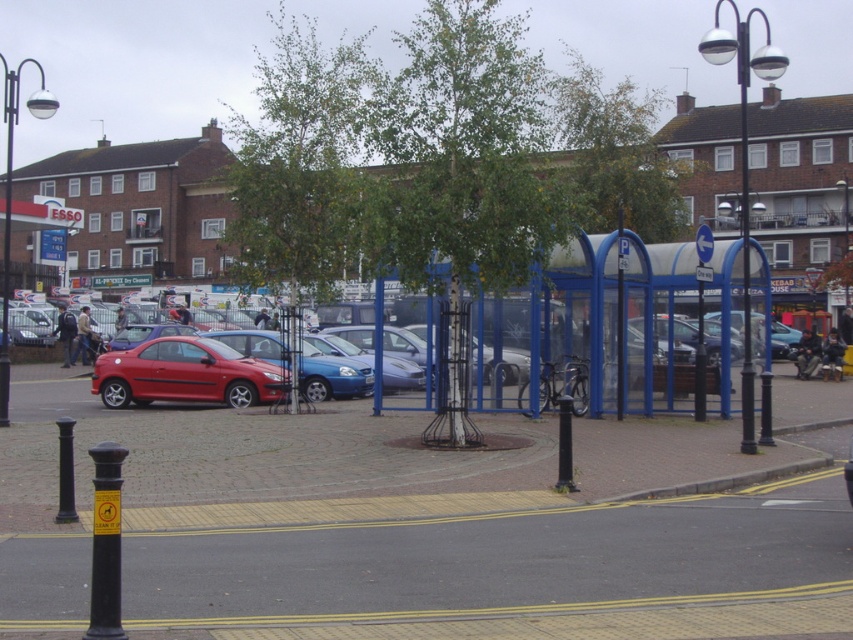
Question: Does metallic silver streetlight at right have a smaller size compared to matte black lamp post at left?

Choices:
 (A) yes
 (B) no

Answer: (A)

Question: Is shiny red car at center-left below metallic silver streetlight at right?

Choices:
 (A) no
 (B) yes

Answer: (B)

Question: Can you confirm if shiny red car at center-left is bigger than matte black lamp post at left?

Choices:
 (A) yes
 (B) no

Answer: (B)

Question: Which point is closer to the camera?

Choices:
 (A) metallic silver streetlight at right
 (B) matte black lamp post at left
 (C) shiny red car at center-left

Answer: (A)

Question: Which object is positioned farthest from the shiny red car at center-left?

Choices:
 (A) metallic silver streetlight at right
 (B) matte black lamp post at left

Answer: (A)

Question: Which point is closer to the camera taking this photo?

Choices:
 (A) click(746, 61)
 (B) click(115, 374)

Answer: (A)